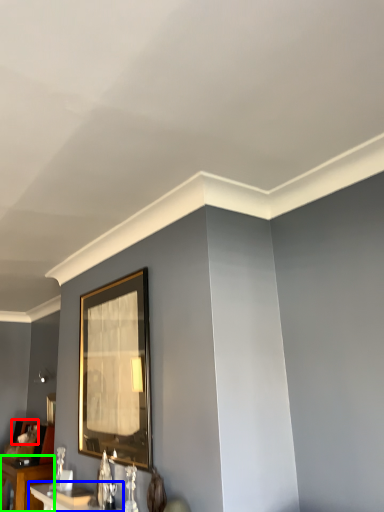
Question: Which object is the closest to the picture frame (highlighted by a red box)? Choose among these: table (highlighted by a blue box) or table (highlighted by a green box).

Choices:
 (A) table
 (B) table

Answer: (B)